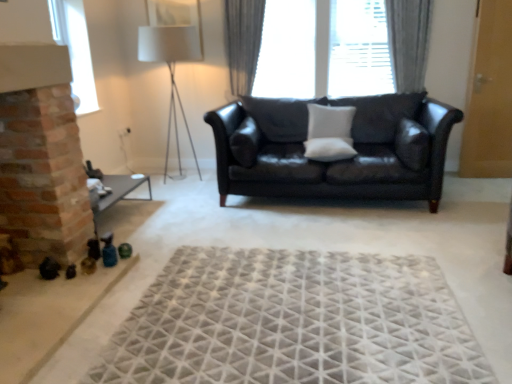
Where is `free space on the front side of shiny black leather couch at center`? The height and width of the screenshot is (384, 512). free space on the front side of shiny black leather couch at center is located at coordinates (307, 290).